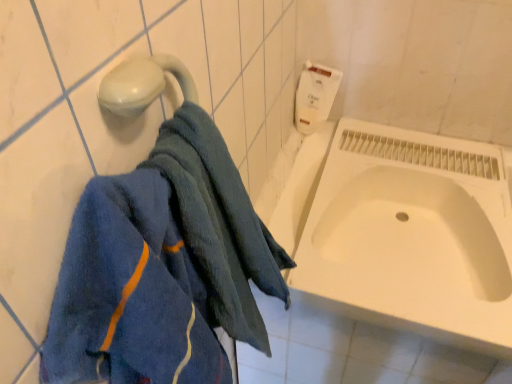
Identify the location of vacant space in between white glossy bathtub at center and white matte toilet paper at upper right. (302, 185).